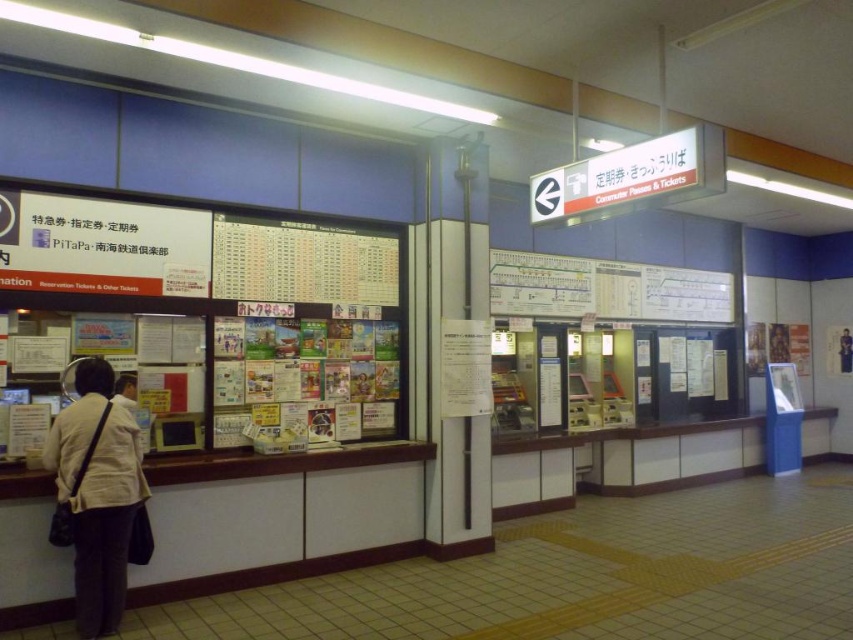
Is point (109, 522) in front of point (125, 406)?

That is True.

Is beige fabric jacket at lower left closer to the viewer compared to light beige jacket at left?

That is True.

Does point (83, 577) lie behind point (123, 404)?

No, (83, 577) is closer to viewer.

You are a GUI agent. You are given a task and a screenshot of the screen. Output one action in this format:
    pyautogui.click(x=<x>, y=<y>)
    Task: Click on the beige fabric jacket at lower left
    The width and height of the screenshot is (853, 640).
    Given the screenshot: What is the action you would take?
    pyautogui.click(x=97, y=492)